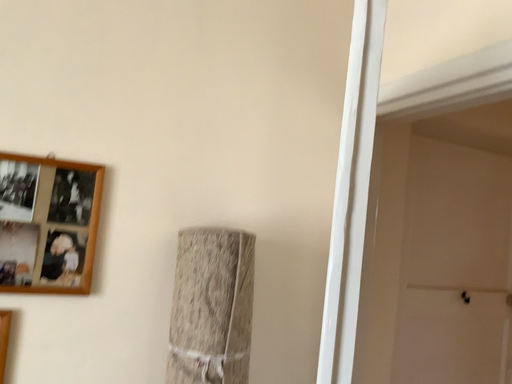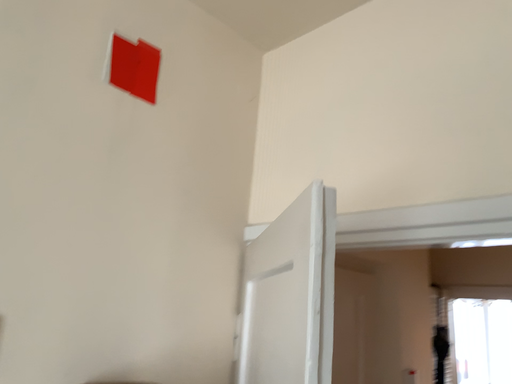
Question: Which way did the camera rotate in the video?

Choices:
 (A) rotated upward
 (B) rotated downward

Answer: (A)